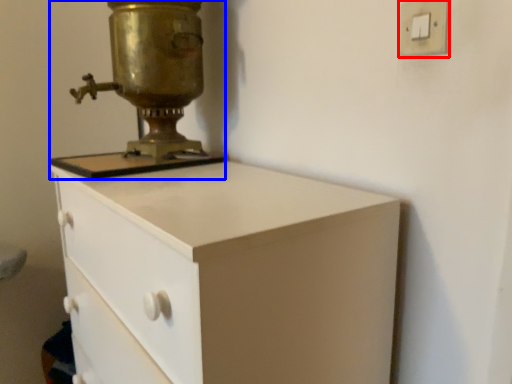
Question: Which point is further to the camera, light switch (highlighted by a red box) or sewing machine (highlighted by a blue box)?

Choices:
 (A) light switch
 (B) sewing machine

Answer: (B)